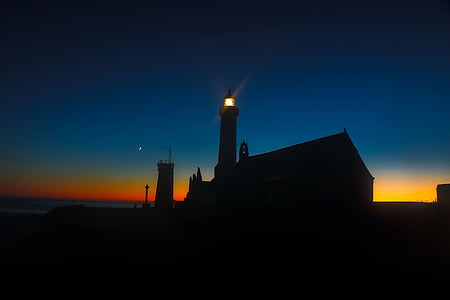
Where is `light`? light is located at coordinates (70, 194).